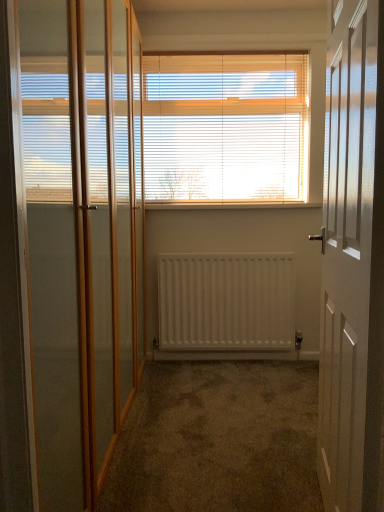
Question: Considering the positions of clear glass screen door at left and white matte radiator at center in the image, is clear glass screen door at left wider or thinner than white matte radiator at center?

Choices:
 (A) wide
 (B) thin

Answer: (A)

Question: Considering their positions, is clear glass screen door at left located in front of or behind white matte radiator at center?

Choices:
 (A) behind
 (B) front

Answer: (B)

Question: Estimate the real-world distances between objects in this image. Which object is closer to the clear glass screen door at left?

Choices:
 (A) white wooden door at right
 (B) white wood blinds at center
 (C) wooden at center
 (D) white matte radiator at center

Answer: (A)

Question: Considering the real-world distances, which object is closest to the white wood blinds at center?

Choices:
 (A) white matte radiator at center
 (B) white wooden door at right
 (C) clear glass screen door at left
 (D) wooden at center

Answer: (D)